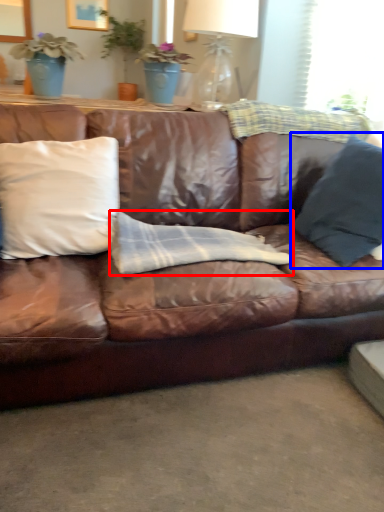
Question: Which object is further to the camera taking this photo, material (highlighted by a red box) or pillow (highlighted by a blue box)?

Choices:
 (A) material
 (B) pillow

Answer: (A)